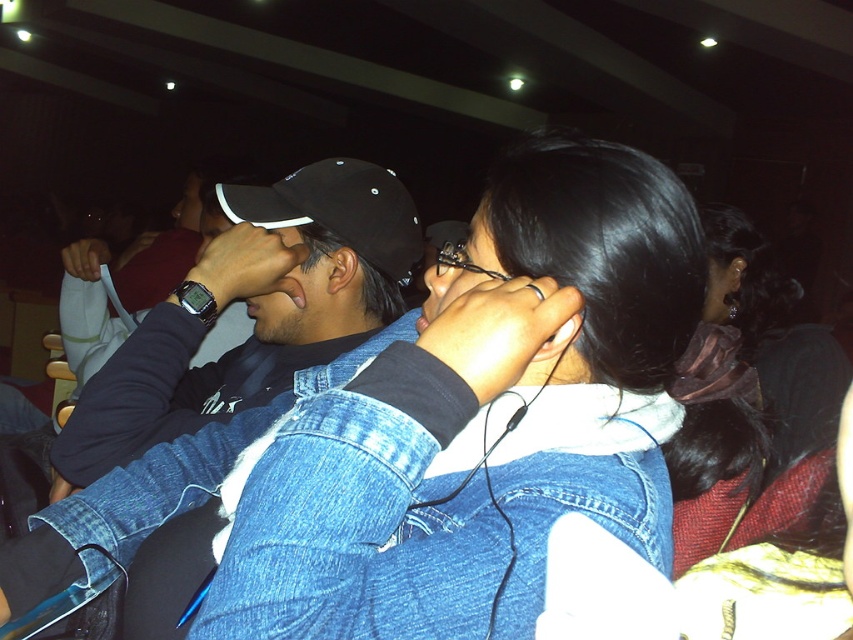
You are a photographer trying to capture a candid shot of the two people in the scene. The black matte cap at upper left and the faded denim jacket at lower right are both in your viewfinder. Which object should you focus on to ensure the other is still in frame?

The black matte cap at upper left is located above faded denim jacket at lower right. To keep both in frame, focus on the faded denim jacket at lower right since it is lower and the cap is above it, so adjusting focus there would maintain both within the viewfinder.

You are a photographer at the event and want to capture a photo that includes both the faded denim jacket at lower right and the black matte baseball cap at center. Based on their positions, which object should be placed higher in the frame to ensure both are visible?

The faded denim jacket at lower right is taller than the black matte baseball cap at center, so to ensure both are visible in the photo, the faded denim jacket at lower right should be placed higher in the frame to accommodate its greater height.

You are trying to decide which item to place in a storage box that can only accommodate items narrower than 30 cm. Based on the scene, can you determine if the faded denim jacket at lower right or the black matte baseball cap at center will fit better in the box?

The faded denim jacket at lower right might be wider than black matte baseball cap at center, so the black matte baseball cap at center is more likely to fit in the storage box since it is narrower.